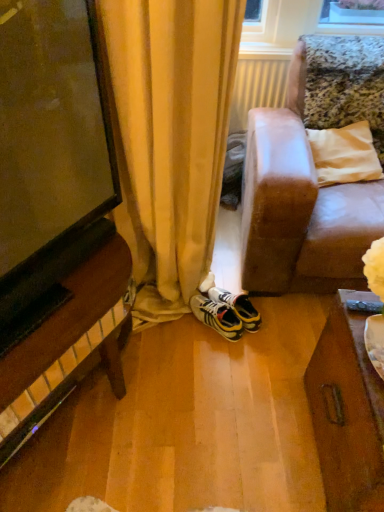
Question: Considering the relative sizes of yellow and black sneakers at center and white plastic radiator at center in the image provided, is yellow and black sneakers at center bigger than white plastic radiator at center?

Choices:
 (A) no
 (B) yes

Answer: (A)

Question: Can you confirm if yellow and black sneakers at center is positioned to the left of white plastic radiator at center?

Choices:
 (A) no
 (B) yes

Answer: (B)

Question: Does yellow and black sneakers at center lie behind white plastic radiator at center?

Choices:
 (A) no
 (B) yes

Answer: (A)

Question: Is yellow and black sneakers at center turned away from white plastic radiator at center?

Choices:
 (A) yes
 (B) no

Answer: (B)

Question: From a real-world perspective, is yellow and black sneakers at center physically above white plastic radiator at center?

Choices:
 (A) yes
 (B) no

Answer: (B)

Question: Does yellow and black sneakers at center have a lesser height compared to white plastic radiator at center?

Choices:
 (A) yes
 (B) no

Answer: (A)

Question: Considering the relative sizes of white plastic radiator at center and yellow and black sneakers at center in the image provided, is white plastic radiator at center thinner than yellow and black sneakers at center?

Choices:
 (A) no
 (B) yes

Answer: (B)

Question: Is white plastic radiator at center turned away from yellow and black sneakers at center?

Choices:
 (A) no
 (B) yes

Answer: (A)

Question: Does white plastic radiator at center appear on the right side of yellow and black sneakers at center?

Choices:
 (A) yes
 (B) no

Answer: (A)

Question: Does white plastic radiator at center touch yellow and black sneakers at center?

Choices:
 (A) no
 (B) yes

Answer: (A)

Question: Is white plastic radiator at center to the left of yellow and black sneakers at center from the viewer's perspective?

Choices:
 (A) no
 (B) yes

Answer: (A)

Question: Is white plastic radiator at center positioned behind yellow and black sneakers at center?

Choices:
 (A) no
 (B) yes

Answer: (B)

Question: Is yellow and black sneakers at center bigger or smaller than white plastic radiator at center?

Choices:
 (A) big
 (B) small

Answer: (B)